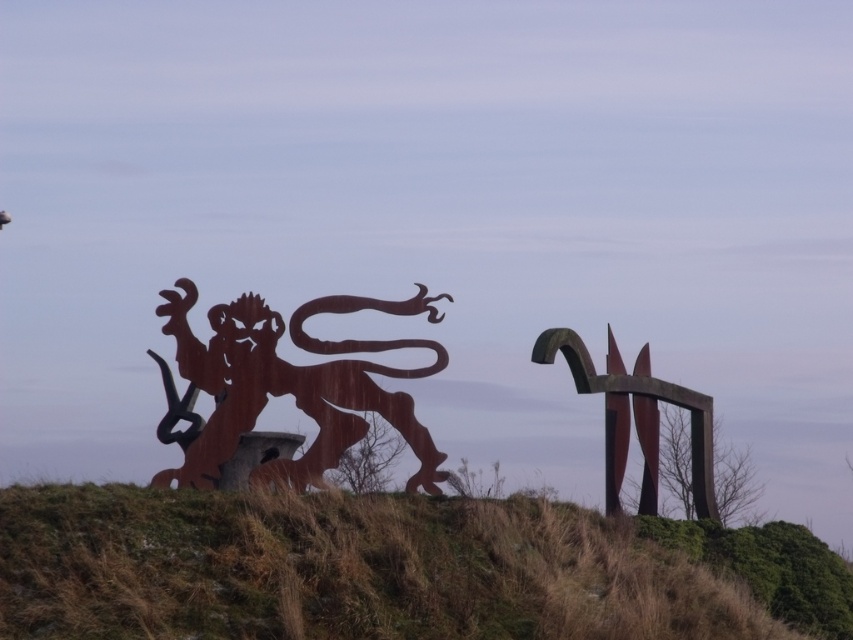
Question: Can you confirm if brown grassy hillside at lower center is wider than rusty metal sculpture at right?

Choices:
 (A) yes
 (B) no

Answer: (A)

Question: Is brown grassy hillside at lower center above rusty metal lion at left?

Choices:
 (A) no
 (B) yes

Answer: (A)

Question: Can you confirm if rusty metal lion at left is positioned below rusty metal sculpture at right?

Choices:
 (A) no
 (B) yes

Answer: (A)

Question: Which object is farther from the camera taking this photo?

Choices:
 (A) brown grassy hillside at lower center
 (B) rusty metal lion at left
 (C) rusty metal sculpture at right

Answer: (C)

Question: Which object is closer to the camera taking this photo?

Choices:
 (A) brown grassy hillside at lower center
 (B) rusty metal lion at left
 (C) rusty metal sculpture at right

Answer: (A)

Question: Which of the following is the farthest from the observer?

Choices:
 (A) rusty metal sculpture at right
 (B) rusty metal lion at left

Answer: (A)